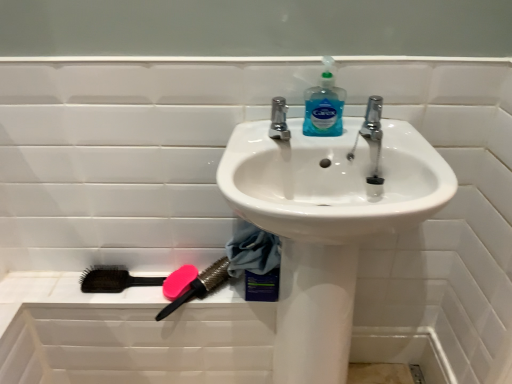
Question: In terms of width, does pink rubber brush at lower left, which is the second brush in left-to-right order, look wider or thinner when compared to chrome metallic faucet at upper center?

Choices:
 (A) thin
 (B) wide

Answer: (B)

Question: Which is correct: pink rubber brush at lower left, which appears as the 1th brush when viewed from the right, is inside chrome metallic faucet at upper center, or outside of it?

Choices:
 (A) inside
 (B) outside

Answer: (B)

Question: Which of these objects is positioned closest to the white glossy sink at center?

Choices:
 (A) chrome metallic faucet at upper center
 (B) translucent plastic soap dispenser at upper center
 (C) black plastic brush at lower left, arranged as the second brush when viewed from the right
 (D) pink rubber soap at lower left
 (E) pink rubber brush at lower left, which is the second brush in left-to-right order

Answer: (B)

Question: Which is nearer to the black plastic brush at lower left, arranged as the second brush when viewed from the right?

Choices:
 (A) pink rubber soap at lower left
 (B) white glossy sink at center
 (C) chrome metallic faucet at upper center
 (D) pink rubber brush at lower left, which is the second brush in left-to-right order
 (E) translucent plastic soap dispenser at upper center

Answer: (A)